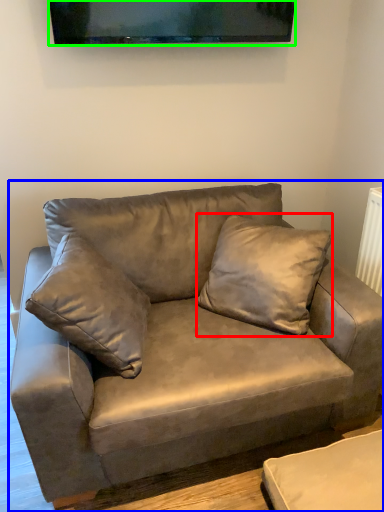
Question: Estimate the real-world distances between objects in this image. Which object is closer to pillow (highlighted by a red box), studio couch (highlighted by a blue box) or television (highlighted by a green box)?

Choices:
 (A) studio couch
 (B) television

Answer: (A)